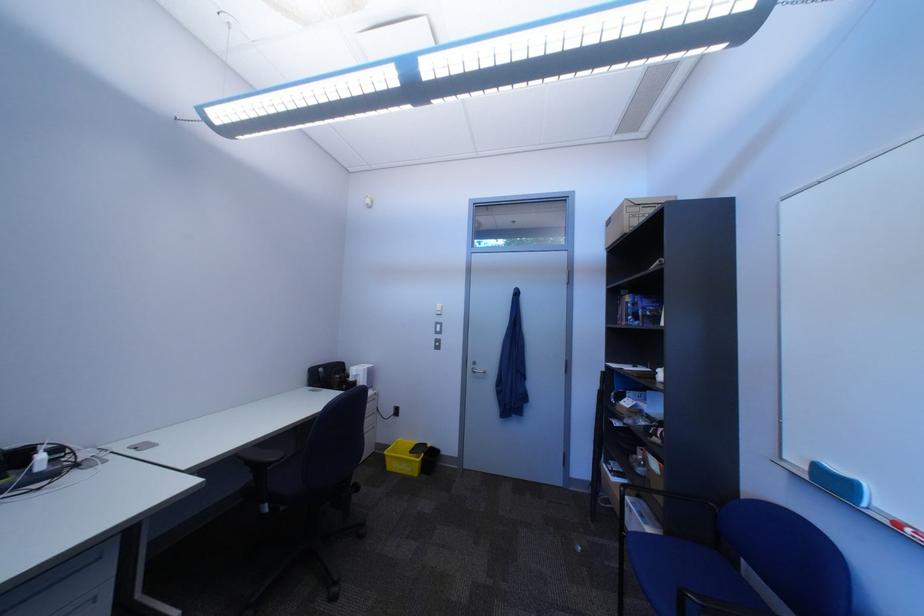
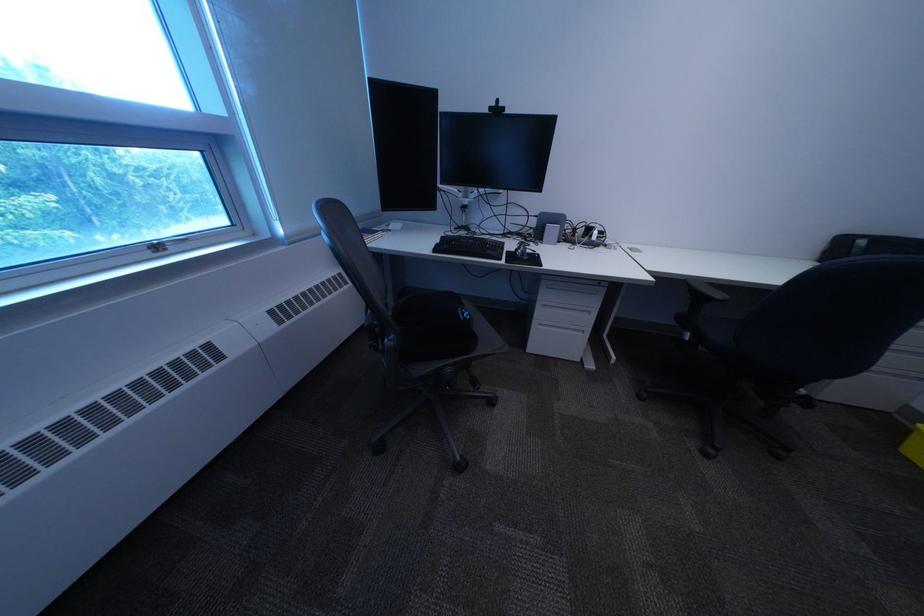
The first image is from the beginning of the video and the second image is from the end. How did the camera likely rotate when shooting the video?

The rotation direction of the camera is left-down.